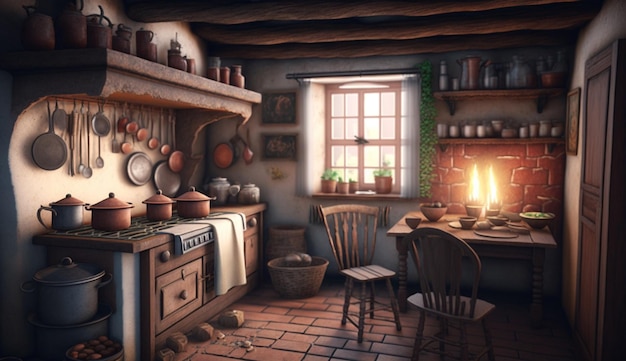
Where is `chair`? The image size is (626, 361). chair is located at coordinates (459, 304), (370, 273).